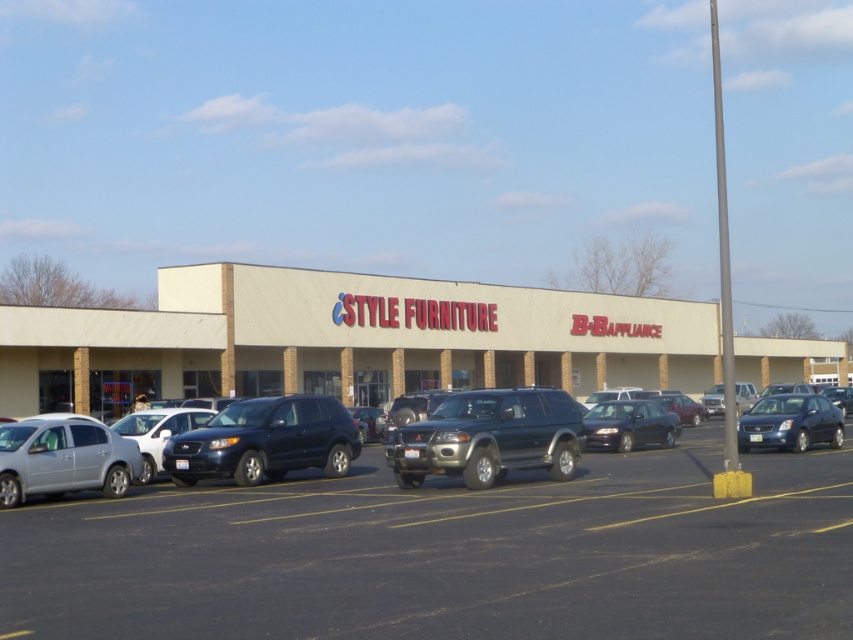
Question: Which of the following is the closest to the observer?

Choices:
 (A) (141, 429)
 (B) (300, 419)
 (C) (416, 621)

Answer: (C)

Question: Is shiny dark blue suv at center smaller than glossy black sedan at center?

Choices:
 (A) yes
 (B) no

Answer: (B)

Question: Which point appears farthest from the camera in this image?

Choices:
 (A) (244, 416)
 (B) (817, 440)

Answer: (B)

Question: Does satin silver sedan at lower left have a larger size compared to silver metallic sedan at center-left?

Choices:
 (A) yes
 (B) no

Answer: (A)

Question: Is beige/concrete mall at center smaller than silver metallic sedan at center-left?

Choices:
 (A) yes
 (B) no

Answer: (B)

Question: Among these objects, which one is farthest from the camera?

Choices:
 (A) beige/concrete mall at center
 (B) dark gray asphalt parking lot at center
 (C) silver metallic sedan at center-left

Answer: (A)